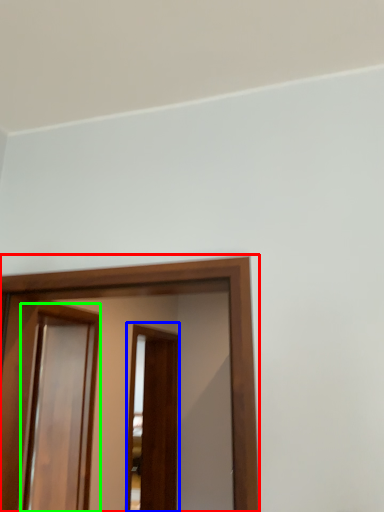
Question: Considering the real-world distances, which object is closest to screen door (highlighted by a red box)? screen door (highlighted by a blue box) or screen door (highlighted by a green box).

Choices:
 (A) screen door
 (B) screen door

Answer: (B)